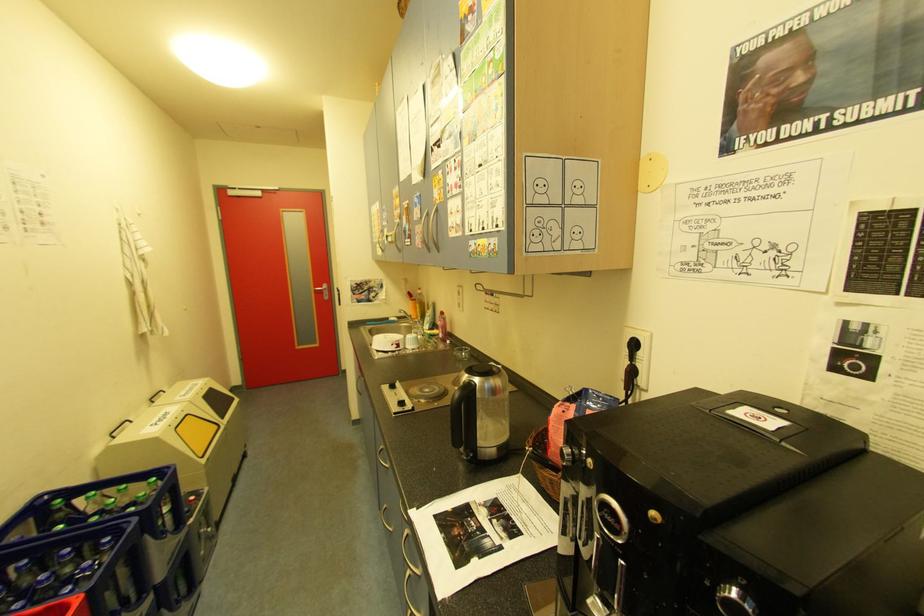
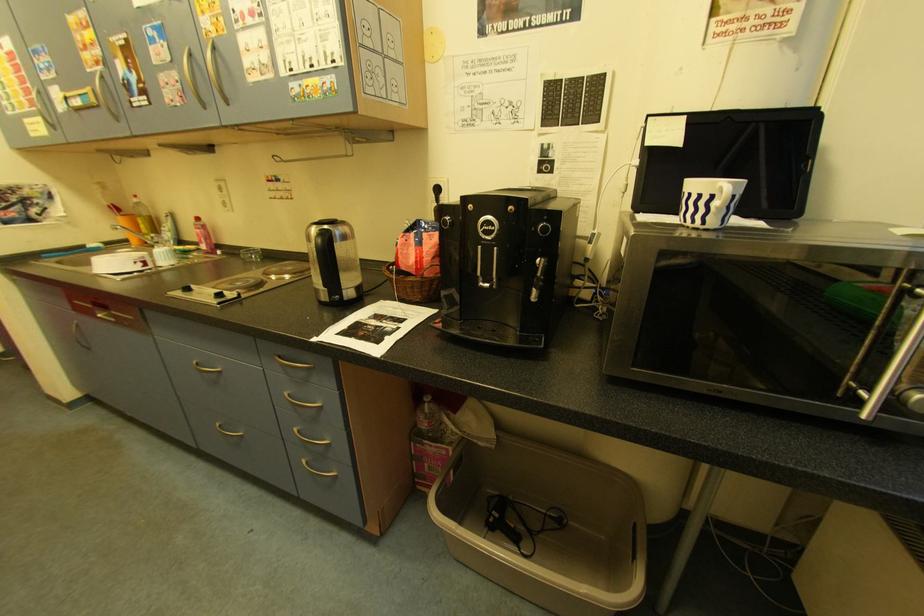
Question: The first image is from the beginning of the video and the second image is from the end. How did the camera likely rotate when shooting the video?

Choices:
 (A) Left
 (B) Right
 (C) Up
 (D) Down

Answer: (B)